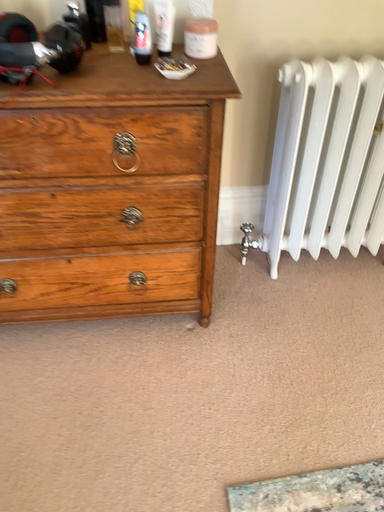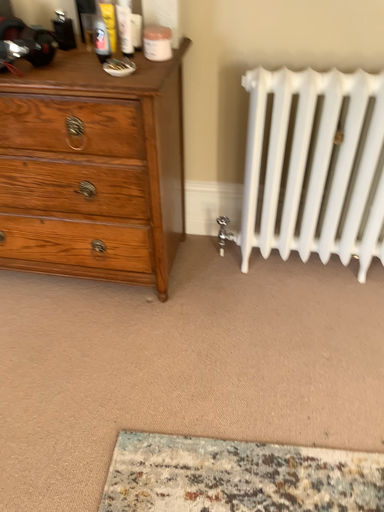
Question: Which way did the camera rotate in the video?

Choices:
 (A) rotated right
 (B) rotated left

Answer: (B)